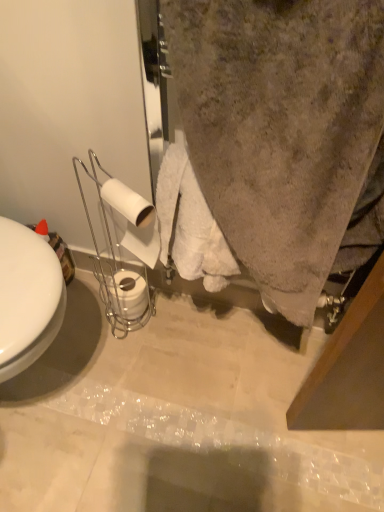
This screenshot has width=384, height=512. In order to click on white matte toilet paper at center left, the 1th toilet paper when ordered from top to bottom in this screenshot , I will do `click(134, 220)`.

What do you see at coordinates (134, 220) in the screenshot?
I see `white matte toilet paper at center left, the 1th toilet paper when ordered from top to bottom` at bounding box center [134, 220].

Measure the distance between point (116, 308) and camera.

Point (116, 308) and camera are 1.19 meters apart from each other.

The image size is (384, 512). Identify the location of white matte toilet paper at lower center, the 1th toilet paper viewed from the back. (128, 294).

How much space does white matte toilet paper at lower center, the 2th toilet paper when ordered from top to bottom, occupy horizontally?

white matte toilet paper at lower center, the 2th toilet paper when ordered from top to bottom, is 4.59 inches wide.

The height and width of the screenshot is (512, 384). Describe the element at coordinates (128, 294) in the screenshot. I see `white matte toilet paper at lower center, arranged as the 2th toilet paper when viewed from the front` at that location.

Locate an element on the screen. Image resolution: width=384 pixels, height=512 pixels. white matte toilet paper at center left, acting as the 2th toilet paper starting from the bottom is located at coordinates (134, 220).

Does white matte toilet paper at lower center, the 2th toilet paper when ordered from top to bottom, appear on the right side of white matte toilet paper at center left, the 1th toilet paper when ordered from top to bottom?

No, white matte toilet paper at lower center, the 2th toilet paper when ordered from top to bottom, is not to the right of white matte toilet paper at center left, the 1th toilet paper when ordered from top to bottom.

From the picture: Does white matte toilet paper at lower center, arranged as the 2th toilet paper when viewed from the front, lie behind white matte toilet paper at center left, acting as the 2th toilet paper starting from the bottom?

That is True.

Is point (139, 295) less distant than point (147, 256)?

No, (139, 295) is further to viewer.

From the image's perspective, is white matte toilet paper at lower center, the 2th toilet paper when ordered from top to bottom, below white matte toilet paper at center left, the 2th toilet paper when ordered from back to front?

Yes, from the image's perspective, white matte toilet paper at lower center, the 2th toilet paper when ordered from top to bottom, is below white matte toilet paper at center left, the 2th toilet paper when ordered from back to front.

From the picture: From a real-world perspective, is white matte toilet paper at lower center, acting as the first toilet paper starting from the bottom, positioned under white matte toilet paper at center left, the 1th toilet paper when ordered from top to bottom, based on gravity?

Correct, in the physical world, white matte toilet paper at lower center, acting as the first toilet paper starting from the bottom, is lower than white matte toilet paper at center left, the 1th toilet paper when ordered from top to bottom.

Looking at this image, can you confirm if white matte toilet paper at lower center, acting as the first toilet paper starting from the bottom, is wider than white matte toilet paper at center left, the 1th toilet paper when ordered from front to back?

Indeed, white matte toilet paper at lower center, acting as the first toilet paper starting from the bottom, has a greater width compared to white matte toilet paper at center left, the 1th toilet paper when ordered from front to back.

Can you confirm if white matte toilet paper at lower center, acting as the first toilet paper starting from the bottom, is taller than white matte toilet paper at center left, the 1th toilet paper when ordered from top to bottom?

No.

Considering the relative sizes of white matte toilet paper at lower center, the 1th toilet paper viewed from the back, and white matte toilet paper at center left, the 2th toilet paper when ordered from back to front, in the image provided, is white matte toilet paper at lower center, the 1th toilet paper viewed from the back, smaller than white matte toilet paper at center left, the 2th toilet paper when ordered from back to front,?

Indeed, white matte toilet paper at lower center, the 1th toilet paper viewed from the back, has a smaller size compared to white matte toilet paper at center left, the 2th toilet paper when ordered from back to front.

Is white matte toilet paper at center left, acting as the 2th toilet paper starting from the bottom, inside white matte toilet paper at lower center, the 2th toilet paper when ordered from top to bottom?

No, white matte toilet paper at center left, acting as the 2th toilet paper starting from the bottom, is not inside white matte toilet paper at lower center, the 2th toilet paper when ordered from top to bottom.

Is white matte toilet paper at lower center, acting as the first toilet paper starting from the bottom, far from white matte toilet paper at center left, the 1th toilet paper when ordered from top to bottom?

Result: No, white matte toilet paper at lower center, acting as the first toilet paper starting from the bottom, is not far from white matte toilet paper at center left, the 1th toilet paper when ordered from top to bottom.

Is white matte toilet paper at lower center, the 1th toilet paper viewed from the back, facing towards white matte toilet paper at center left, the 2th toilet paper when ordered from back to front?

No, white matte toilet paper at lower center, the 1th toilet paper viewed from the back, is not aimed at white matte toilet paper at center left, the 2th toilet paper when ordered from back to front.

How far apart are white matte toilet paper at lower center, the 1th toilet paper viewed from the back, and white matte toilet paper at center left, the 1th toilet paper when ordered from top to bottom?

white matte toilet paper at lower center, the 1th toilet paper viewed from the back, is 11.39 inches away from white matte toilet paper at center left, the 1th toilet paper when ordered from top to bottom.

Where is `toilet paper below the white matte toilet paper at center left, the 2th toilet paper when ordered from back to front (from the image's perspective)`? toilet paper below the white matte toilet paper at center left, the 2th toilet paper when ordered from back to front (from the image's perspective) is located at coordinates (128, 294).

Which is more to the right, white matte toilet paper at center left, the 2th toilet paper when ordered from back to front, or white matte toilet paper at lower center, the 1th toilet paper viewed from the back?

white matte toilet paper at center left, the 2th toilet paper when ordered from back to front.

In the image, is white matte toilet paper at center left, the 1th toilet paper when ordered from top to bottom, positioned in front of or behind white matte toilet paper at lower center, arranged as the 2th toilet paper when viewed from the front?

In the image, white matte toilet paper at center left, the 1th toilet paper when ordered from top to bottom, appears in front of white matte toilet paper at lower center, arranged as the 2th toilet paper when viewed from the front.

Is point (107, 182) more distant than point (128, 308)?

No, it is not.

From the image's perspective, between white matte toilet paper at center left, acting as the 2th toilet paper starting from the bottom, and white matte toilet paper at lower center, acting as the first toilet paper starting from the bottom, which one is located above?

white matte toilet paper at center left, acting as the 2th toilet paper starting from the bottom, is shown above in the image.

From a real-world perspective, which is physically above, white matte toilet paper at center left, the 1th toilet paper when ordered from front to back, or white matte toilet paper at lower center, acting as the first toilet paper starting from the bottom?

white matte toilet paper at center left, the 1th toilet paper when ordered from front to back, is physically above.

Which of these two, white matte toilet paper at center left, the 2th toilet paper when ordered from back to front, or white matte toilet paper at lower center, acting as the first toilet paper starting from the bottom, is thinner?

white matte toilet paper at center left, the 2th toilet paper when ordered from back to front, is thinner.

Who is shorter, white matte toilet paper at center left, the 1th toilet paper when ordered from top to bottom, or white matte toilet paper at lower center, the 2th toilet paper when ordered from top to bottom?

Standing shorter between the two is white matte toilet paper at lower center, the 2th toilet paper when ordered from top to bottom.

Between white matte toilet paper at center left, the 1th toilet paper when ordered from front to back, and white matte toilet paper at lower center, the 2th toilet paper when ordered from top to bottom, which one has larger size?

Bigger between the two is white matte toilet paper at center left, the 1th toilet paper when ordered from front to back.

Is white matte toilet paper at center left, the 1th toilet paper when ordered from top to bottom, positioned beyond the bounds of white matte toilet paper at lower center, arranged as the 2th toilet paper when viewed from the front?

Yes.

Are white matte toilet paper at center left, the 2th toilet paper when ordered from back to front, and white matte toilet paper at lower center, the 1th toilet paper viewed from the back, far apart?

That's not correct — white matte toilet paper at center left, the 2th toilet paper when ordered from back to front, is a little close to white matte toilet paper at lower center, the 1th toilet paper viewed from the back.

Could you tell me if white matte toilet paper at center left, acting as the 2th toilet paper starting from the bottom, is facing white matte toilet paper at lower center, acting as the first toilet paper starting from the bottom?

No.

Locate an element on the screen. Image resolution: width=384 pixels, height=512 pixels. toilet paper behind the white matte toilet paper at center left, the 1th toilet paper when ordered from front to back is located at coordinates (128, 294).

At what (x,y) coordinates should I click in order to perform the action: click on toilet paper that appears above the white matte toilet paper at lower center, arranged as the 2th toilet paper when viewed from the front (from a real-world perspective). Please return your answer as a coordinate pair (x, y). Image resolution: width=384 pixels, height=512 pixels. Looking at the image, I should click on (134, 220).

Find the location of a particular element. toilet paper above the white matte toilet paper at lower center, arranged as the 2th toilet paper when viewed from the front (from the image's perspective) is located at coordinates (134, 220).